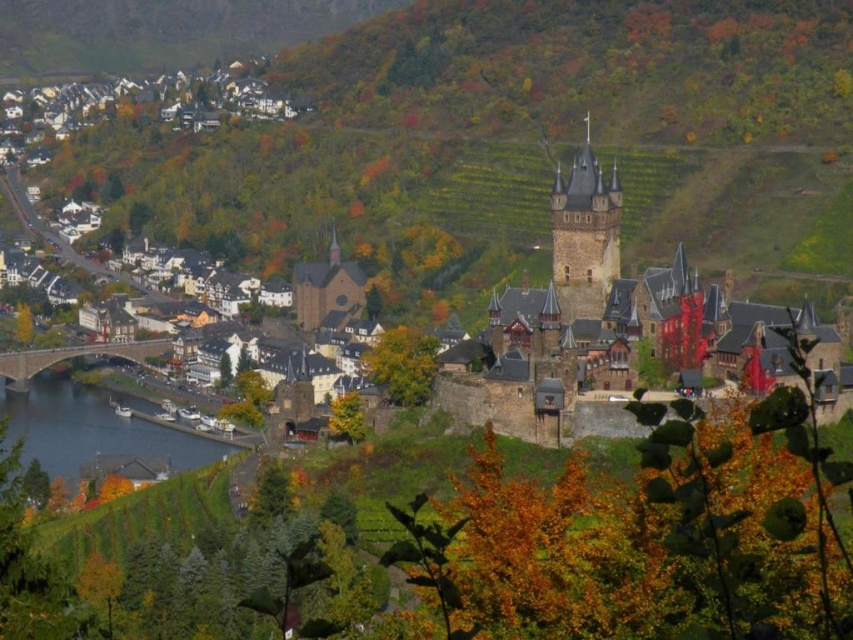
You are standing at the point labeled point [163,451] and want to take a photo of the castle. However, there is a large tree blocking your view. To get a clear shot, should you move toward point [12,385] or away from it?

You should move toward point [12,385] because point [163,451] is closer to the camera than point [12,385], meaning moving towards the latter would bring you closer to the tree and potentially block the view more. Wait, this seems contradictory. Let me think again. Since point [163,451] is closer to the camera, moving towards point [12,385] would mean moving away from the camera position. Hmm, perhaps the answer needs to consider spatial relationships more carefully. Alternatively, maybe if

You are a tourist standing at the edge of the historic town, wanting to cross from the blue water at lower left to the stone bridge at lower left. Can you walk directly between them? Explain your reasoning based on the distance provided.

The blue water at lower left and stone bridge at lower left are 12.17 meters apart. Since the distance is quite large, you cannot walk directly between them without a path or structure connecting them.